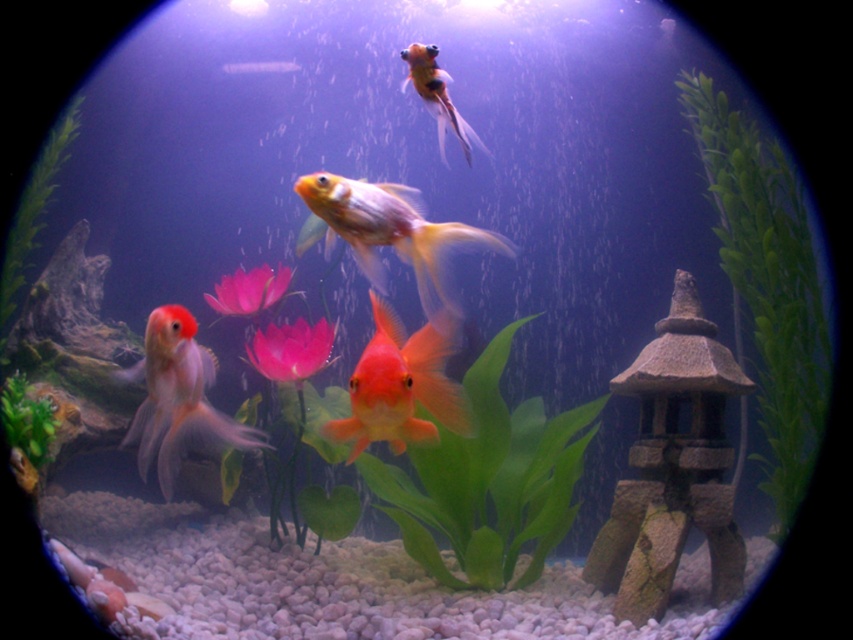
Is green leafy plant at right bigger than green leafy plant at center?

Yes.

Is point (741, 227) closer to camera compared to point (494, 424)?

No, (741, 227) is behind (494, 424).

Is point (796, 362) behind point (514, 520)?

That is True.

At what (x,y) coordinates should I click in order to perform the action: click on green leafy plant at right. Please return your answer as a coordinate pair (x, y). Looking at the image, I should click on (767, 284).

Is green matte plant at lower left below shiny orange fish at upper center?

Yes, green matte plant at lower left is below shiny orange fish at upper center.

Between green matte plant at lower left and shiny orange fish at upper center, which one has more height?

Standing taller between the two is shiny orange fish at upper center.

The width and height of the screenshot is (853, 640). Describe the element at coordinates (26, 422) in the screenshot. I see `green matte plant at lower left` at that location.

You are a GUI agent. You are given a task and a screenshot of the screen. Output one action in this format:
    pyautogui.click(x=<x>, y=<y>)
    Task: Click on the green matte plant at lower left
    The image size is (853, 640).
    Given the screenshot: What is the action you would take?
    pyautogui.click(x=26, y=422)

Which is more to the right, green leafy plant at center or glossy orange goldfish at center?

From the viewer's perspective, green leafy plant at center appears more on the right side.

Can you confirm if green leafy plant at center is smaller than glossy orange goldfish at center?

No.

Find the location of a particular element. green leafy plant at center is located at coordinates (486, 481).